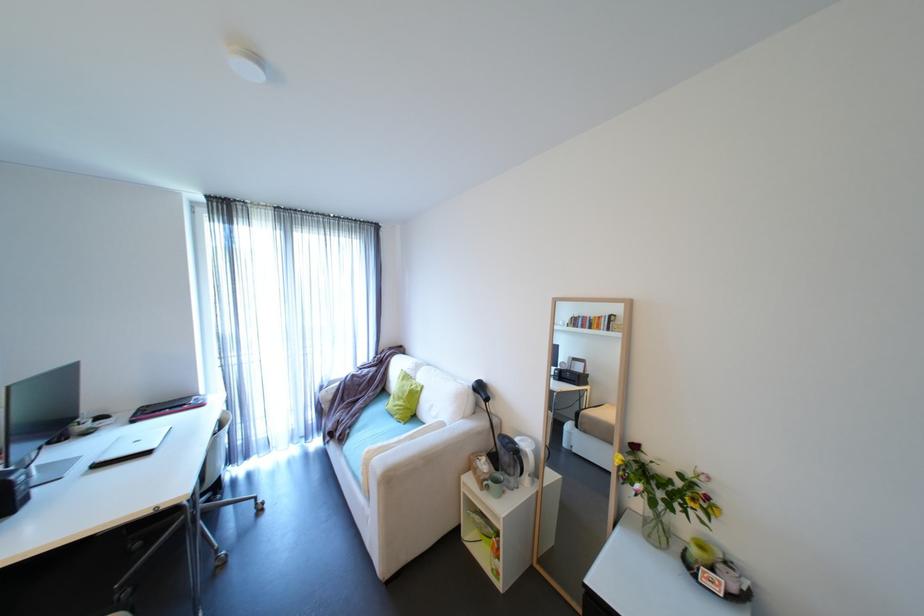
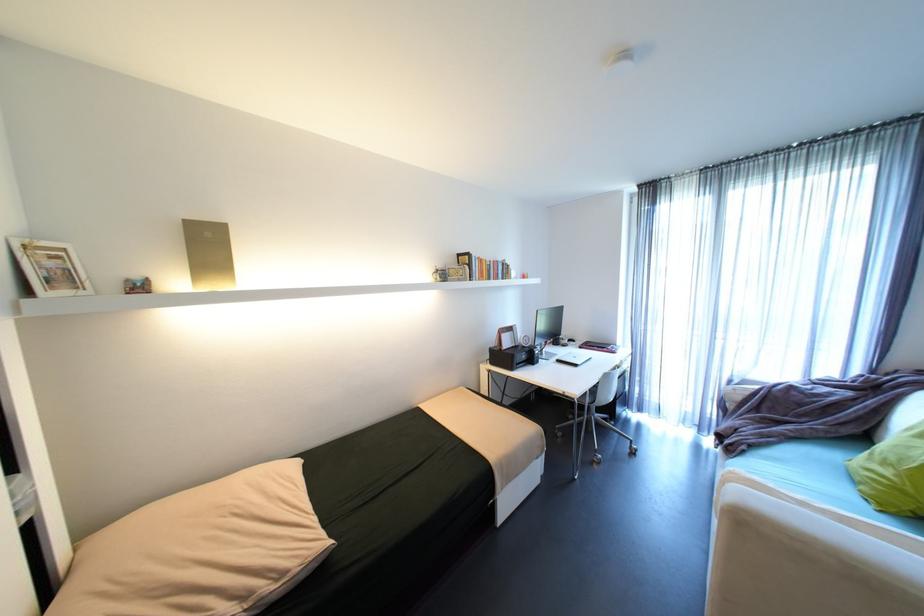
Question: The camera is either moving clockwise (left) or counter-clockwise (right) around the object. The first image is from the beginning of the video and the second image is from the end. Is the camera moving left or right when shooting the video?

Choices:
 (A) Left
 (B) Right

Answer: (B)